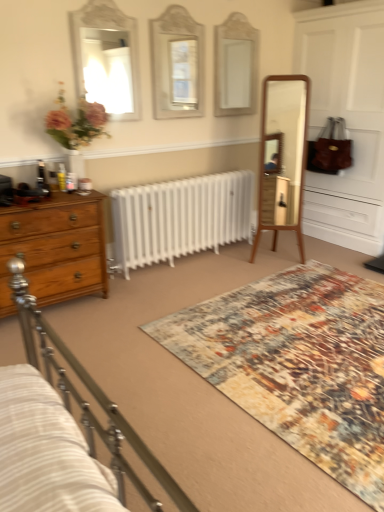
What do you see at coordinates (55, 248) in the screenshot?
I see `wooden chest of drawers at left` at bounding box center [55, 248].

Identify the location of matte white mirror at center, acting as the 2th mirror starting from the right. This screenshot has width=384, height=512. (177, 64).

Where is `white glossy mirror at upper left, the first mirror viewed from the left`? The height and width of the screenshot is (512, 384). white glossy mirror at upper left, the first mirror viewed from the left is located at coordinates 106,58.

Locate an element on the screen. Image resolution: width=384 pixels, height=512 pixels. wooden chest of drawers at left is located at coordinates (55, 248).

Choose the correct answer: Is white glossy mirror at upper left, acting as the third mirror starting from the right, inside matte white mirror at center, the second mirror in the left-to-right sequence, or outside it?

white glossy mirror at upper left, acting as the third mirror starting from the right, cannot be found inside matte white mirror at center, the second mirror in the left-to-right sequence.

From a real-world perspective, which object rests below the other?

matte white mirror at center, the second mirror in the left-to-right sequence.

Is white glossy mirror at upper left, the first mirror viewed from the left, taller or shorter than matte white mirror at center, acting as the 2th mirror starting from the right?

Clearly, white glossy mirror at upper left, the first mirror viewed from the left, is shorter compared to matte white mirror at center, acting as the 2th mirror starting from the right.

Locate an element on the screen. This screenshot has width=384, height=512. the 1st mirror behind when counting from the white glossy mirror at upper left, acting as the third mirror starting from the right is located at coordinates click(x=177, y=64).

How different are the orientations of wooden chest of drawers at left and white glossy mirror at upper left, acting as the third mirror starting from the right, in degrees?

The facing directions of wooden chest of drawers at left and white glossy mirror at upper left, acting as the third mirror starting from the right, are 0.127 degrees apart.

Considering the relative sizes of wooden chest of drawers at left and white glossy mirror at upper left, the first mirror viewed from the left, in the image provided, is wooden chest of drawers at left wider than white glossy mirror at upper left, the first mirror viewed from the left,?

Yes, wooden chest of drawers at left is wider than white glossy mirror at upper left, the first mirror viewed from the left.

Which of these two, wooden chest of drawers at left or white glossy mirror at upper left, acting as the third mirror starting from the right, stands shorter?

wooden chest of drawers at left.

Consider the image. Is wooden chest of drawers at left oriented away from white glossy mirror at upper left, the first mirror viewed from the left?

No.

From a real-world perspective, which is physically below, white glass mirror at upper center, which is the first mirror from right to left, or wooden chest of drawers at left?

In real-world perspective, wooden chest of drawers at left is lower.

From the image's perspective, is white glass mirror at upper center, arranged as the third mirror when viewed from the left, over wooden chest of drawers at left?

Indeed, from the image's perspective, white glass mirror at upper center, arranged as the third mirror when viewed from the left, is shown above wooden chest of drawers at left.

In terms of width, does white glass mirror at upper center, which is the first mirror from right to left, look wider or thinner when compared to wooden chest of drawers at left?

Clearly, white glass mirror at upper center, which is the first mirror from right to left, has less width compared to wooden chest of drawers at left.

Is white glass mirror at upper center, arranged as the third mirror when viewed from the left, shorter than wooden chest of drawers at left?

In fact, white glass mirror at upper center, arranged as the third mirror when viewed from the left, may be taller than wooden chest of drawers at left.

Is wooden chest of drawers at left oriented away from white glass mirror at upper center, arranged as the third mirror when viewed from the left?

No, wooden chest of drawers at left is not facing the opposite direction of white glass mirror at upper center, arranged as the third mirror when viewed from the left.

Based on the photo, how distant is wooden chest of drawers at left from white glass mirror at upper center, which is the first mirror from right to left?

The distance of wooden chest of drawers at left from white glass mirror at upper center, which is the first mirror from right to left, is 2.06 meters.

Is point (7, 308) positioned after point (230, 110)?

That is False.

Would you say wooden chest of drawers at left is a long distance from white glass mirror at upper center, arranged as the third mirror when viewed from the left?

That's right, there is a large distance between wooden chest of drawers at left and white glass mirror at upper center, arranged as the third mirror when viewed from the left.

Where is `mat lying below the white glossy mirror at upper left, acting as the third mirror starting from the right (from the image's perspective)`? mat lying below the white glossy mirror at upper left, acting as the third mirror starting from the right (from the image's perspective) is located at coordinates (298, 364).

Considering the sizes of multicolored textured rug at center and white glossy mirror at upper left, the first mirror viewed from the left, in the image, is multicolored textured rug at center taller or shorter than white glossy mirror at upper left, the first mirror viewed from the left,?

Considering their sizes, multicolored textured rug at center has less height than white glossy mirror at upper left, the first mirror viewed from the left.

Is multicolored textured rug at center touching white glossy mirror at upper left, the first mirror viewed from the left?

No, multicolored textured rug at center is not beside white glossy mirror at upper left, the first mirror viewed from the left.

What's the angular difference between multicolored textured rug at center and white glossy mirror at upper left, the first mirror viewed from the left,'s facing directions?

The facing directions of multicolored textured rug at center and white glossy mirror at upper left, the first mirror viewed from the left, are 88.8 degrees apart.

Is white glossy mirror at upper left, the first mirror viewed from the left, to the left or to the right of multicolored textured rug at center in the image?

white glossy mirror at upper left, the first mirror viewed from the left, is to the left of multicolored textured rug at center.

Does point (136, 31) come farther from viewer compared to point (307, 329)?

Yes, point (136, 31) is farther from viewer.

From a real-world perspective, is white glossy mirror at upper left, acting as the third mirror starting from the right, located beneath multicolored textured rug at center?

No.

From the image's perspective, who appears lower, white glossy mirror at upper left, the first mirror viewed from the left, or multicolored textured rug at center?

multicolored textured rug at center is shown below in the image.

From a real-world perspective, is matte white mirror at center, the second mirror in the left-to-right sequence, on top of wooden chest of drawers at left?

Correct, in the physical world, matte white mirror at center, the second mirror in the left-to-right sequence, is higher than wooden chest of drawers at left.

From a real-world perspective, count 1st mirrors upward from the wooden chest of drawers at left and point to it. Please provide its 2D coordinates.

[(177, 64)]

From the picture: How different are the orientations of matte white mirror at center, the second mirror in the left-to-right sequence, and wooden chest of drawers at left in degrees?

The angle between the facing direction of matte white mirror at center, the second mirror in the left-to-right sequence, and the facing direction of wooden chest of drawers at left is 0.164 degrees.

From the picture: Which of these two, matte white mirror at center, acting as the 2th mirror starting from the right, or wooden chest of drawers at left, is bigger?

wooden chest of drawers at left is bigger.

You are a GUI agent. You are given a task and a screenshot of the screen. Output one action in this format:
    pyautogui.click(x=<x>, y=<y>)
    Task: Click on the mirror to the left of matte white mirror at center, acting as the 2th mirror starting from the right
    Image resolution: width=384 pixels, height=512 pixels.
    Given the screenshot: What is the action you would take?
    pyautogui.click(x=106, y=58)

The height and width of the screenshot is (512, 384). I want to click on chest of drawers in front of the white glossy mirror at upper left, acting as the third mirror starting from the right, so click(55, 248).

Looking at this image, estimate the real-world distances between objects in this image. Which object is further from white glossy mirror at upper left, acting as the third mirror starting from the right, multicolored textured rug at center or white glass mirror at upper center, arranged as the third mirror when viewed from the left?

Among the two, multicolored textured rug at center is located further to white glossy mirror at upper left, acting as the third mirror starting from the right.

Considering their positions, is wooden chest of drawers at left positioned further to multicolored textured rug at center than white glass mirror at upper center, arranged as the third mirror when viewed from the left?

white glass mirror at upper center, arranged as the third mirror when viewed from the left, is positioned further to the anchor multicolored textured rug at center.

Looking at this image, estimate the real-world distances between objects in this image. Which object is further from matte white mirror at center, the second mirror in the left-to-right sequence, wooden chest of drawers at left or multicolored textured rug at center?

multicolored textured rug at center is further to matte white mirror at center, the second mirror in the left-to-right sequence.

When comparing their distances from wooden chest of drawers at left, does white glass mirror at upper center, which is the first mirror from right to left, or white glossy mirror at upper left, the first mirror viewed from the left, seem closer?

Based on the image, white glossy mirror at upper left, the first mirror viewed from the left, appears to be nearer to wooden chest of drawers at left.

Considering their positions, is matte white mirror at center, the second mirror in the left-to-right sequence, positioned closer to wooden chest of drawers at left than white glass mirror at upper center, arranged as the third mirror when viewed from the left?

The object closer to wooden chest of drawers at left is matte white mirror at center, the second mirror in the left-to-right sequence.

Which object lies further to the anchor point white glossy mirror at upper left, acting as the third mirror starting from the right, white glass mirror at upper center, arranged as the third mirror when viewed from the left, or matte white mirror at center, acting as the 2th mirror starting from the right?

Among the two, white glass mirror at upper center, arranged as the third mirror when viewed from the left, is located further to white glossy mirror at upper left, acting as the third mirror starting from the right.

From the picture: When comparing their distances from white glass mirror at upper center, which is the first mirror from right to left, does white glossy mirror at upper left, acting as the third mirror starting from the right, or multicolored textured rug at center seem closer?

Based on the image, white glossy mirror at upper left, acting as the third mirror starting from the right, appears to be nearer to white glass mirror at upper center, which is the first mirror from right to left.

When comparing their distances from wooden chest of drawers at left, does white glass mirror at upper center, arranged as the third mirror when viewed from the left, or matte white mirror at center, the second mirror in the left-to-right sequence, seem closer?

matte white mirror at center, the second mirror in the left-to-right sequence, lies closer to wooden chest of drawers at left than the other object.

This screenshot has width=384, height=512. I want to click on mirror between white glossy mirror at upper left, the first mirror viewed from the left, and white glass mirror at upper center, which is the first mirror from right to left, so click(177, 64).

Locate an element on the screen. The image size is (384, 512). mirror between matte white mirror at center, acting as the 2th mirror starting from the right, and wooden chest of drawers at left from top to bottom is located at coordinates (106, 58).

Identify the location of chest of drawers between matte white mirror at center, acting as the 2th mirror starting from the right, and multicolored textured rug at center, in the vertical direction. This screenshot has height=512, width=384. (55, 248).

The width and height of the screenshot is (384, 512). What are the coordinates of `the chest of drawers that lies between white glass mirror at upper center, arranged as the third mirror when viewed from the left, and multicolored textured rug at center from top to bottom` in the screenshot? It's located at (55, 248).